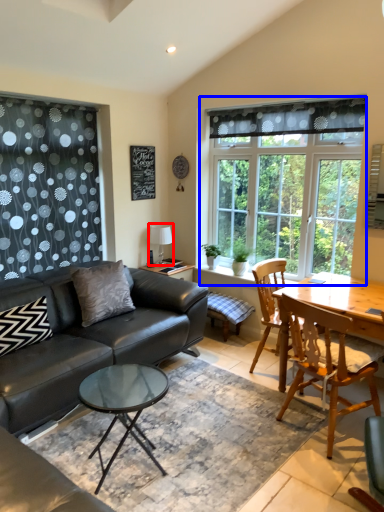
Question: Among these objects, which one is nearest to the camera, lamp (highlighted by a red box) or window (highlighted by a blue box)?

Choices:
 (A) lamp
 (B) window

Answer: (B)